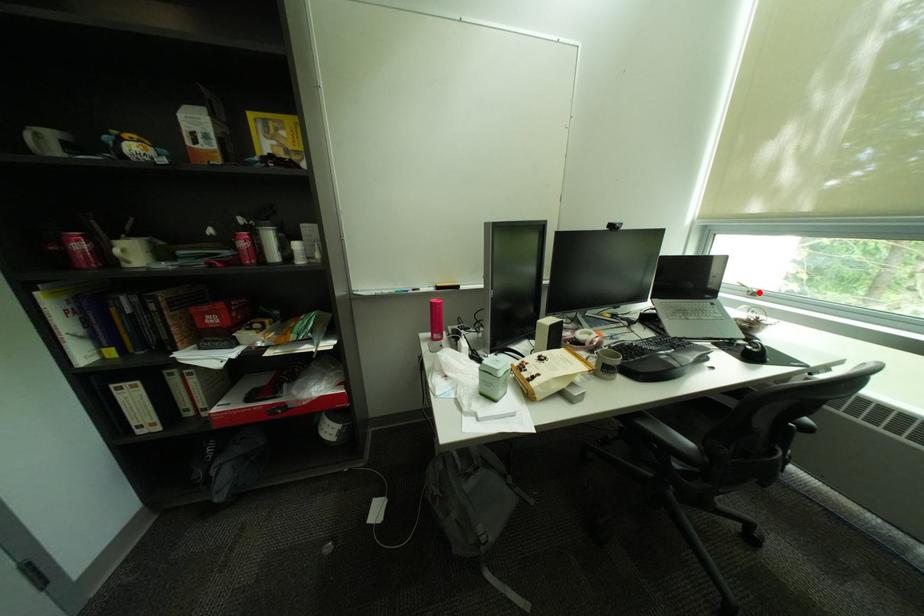
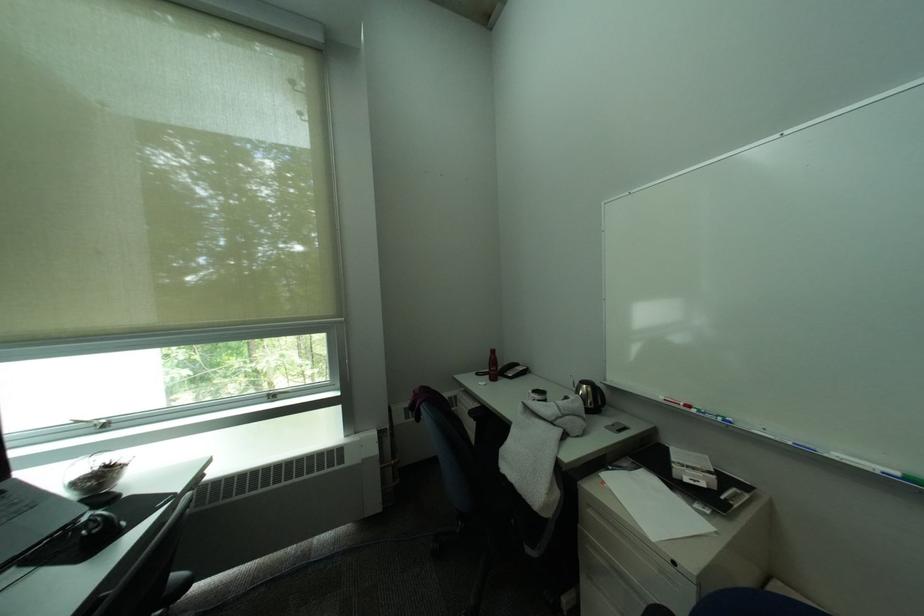
Locate, in the second image, the point that corresponds to the highlighted location in the first image.

(106, 427)